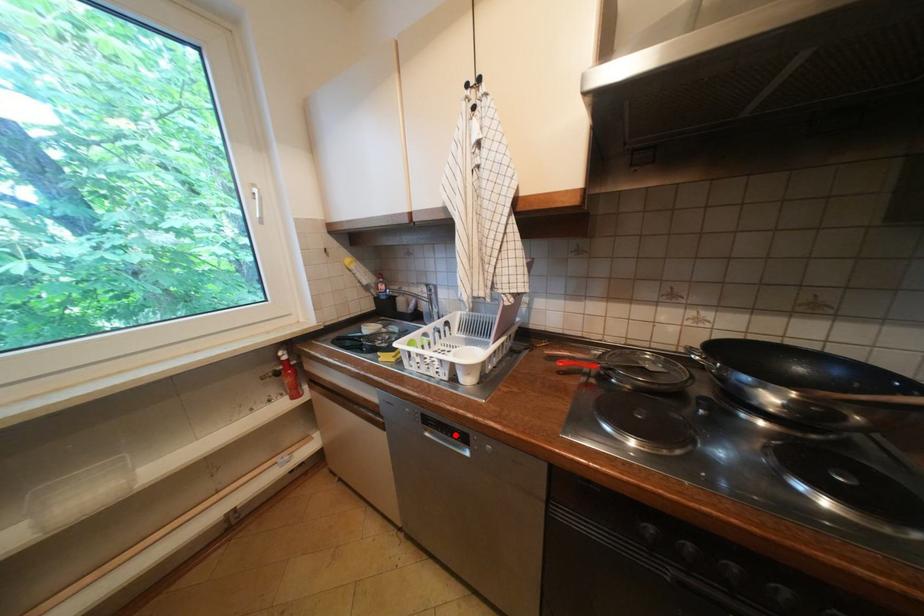
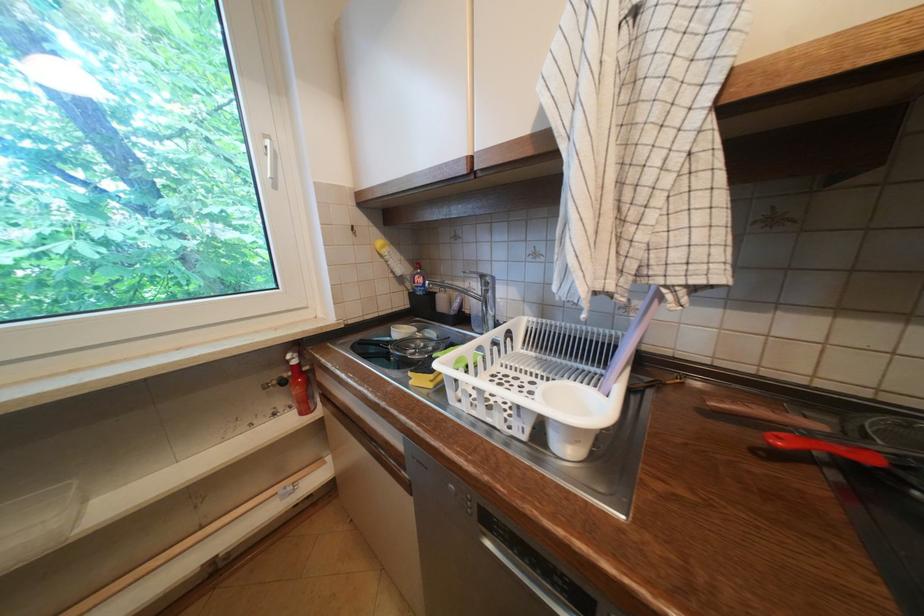
Locate, in the second image, the point that corresponds to the highlighted location in the first image.

(541, 567)